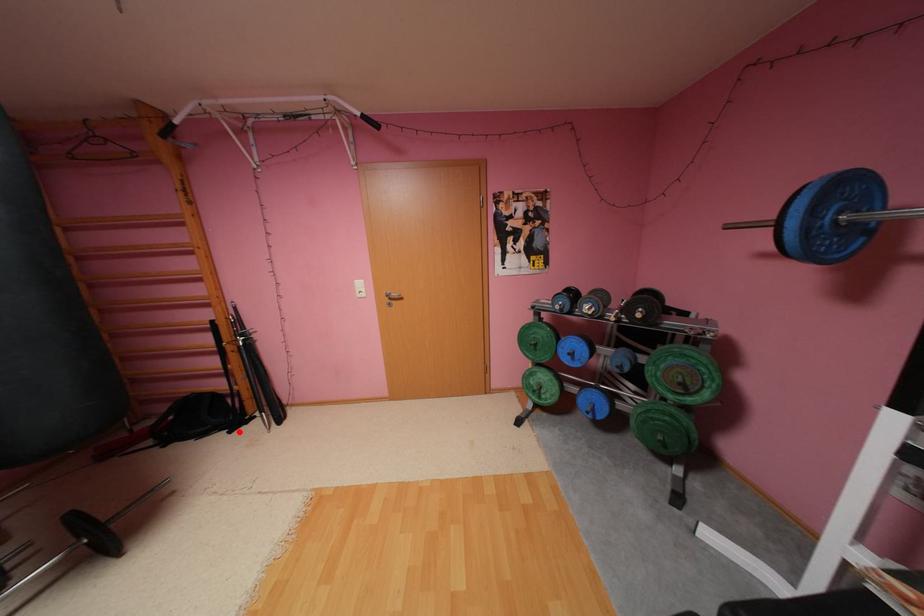
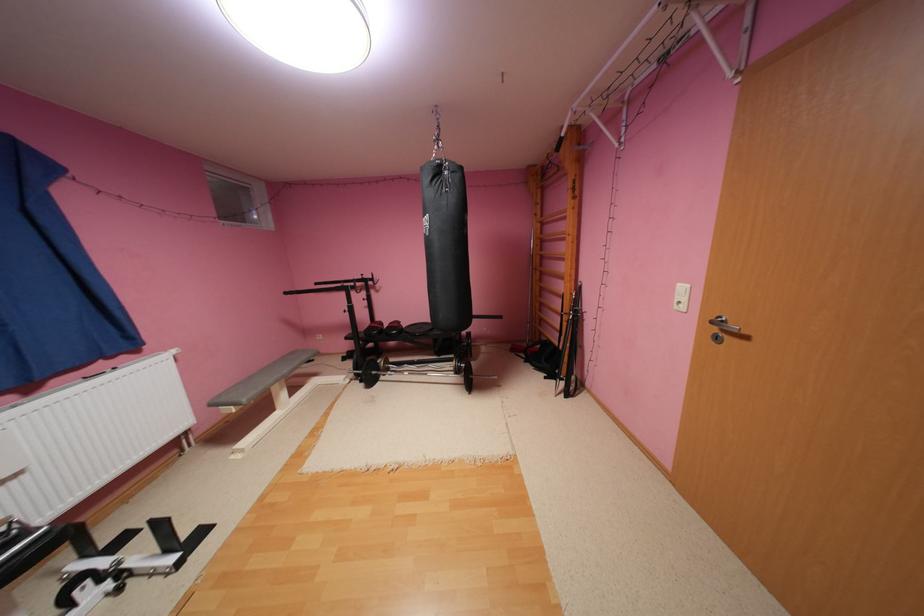
Question: A red point is marked in image1. In image2, is the corresponding 3D point closer to the camera or farther? Reply with the corresponding letter.

Choices:
 (A) The corresponding 3D point is closer.
 (B) The corresponding 3D point is farther.

Answer: (B)